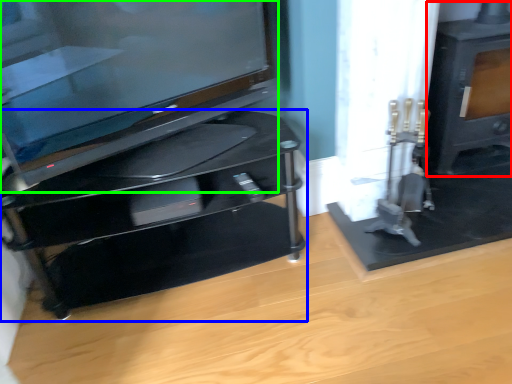
Question: Based on their relative distances, which object is nearer to stove (highlighted by a red box)? Choose from furniture (highlighted by a blue box) and television (highlighted by a green box).

Choices:
 (A) furniture
 (B) television

Answer: (A)